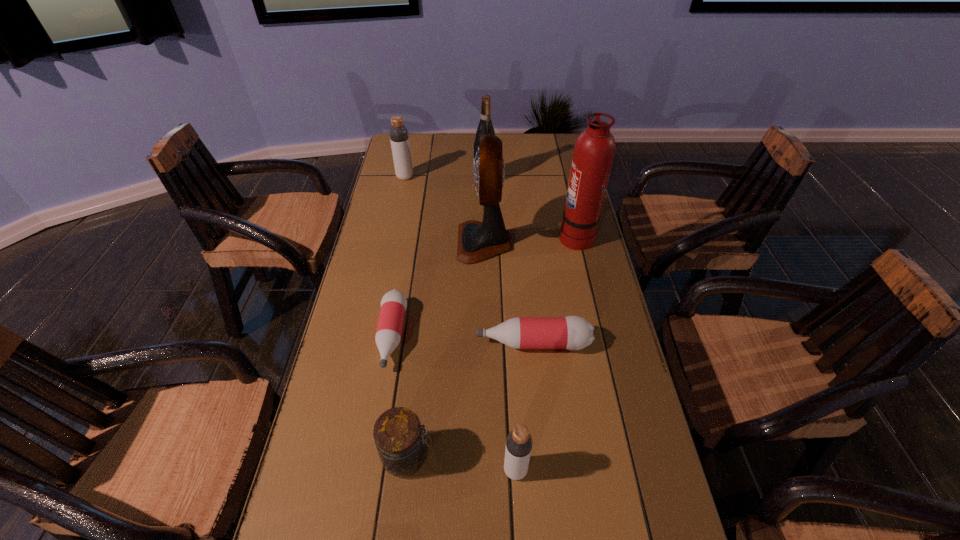
In the image, there is a desktop. At what (x,y) coordinates should I click in order to perform the action: click on free space at the left edge. Please return your answer as a coordinate pair (x, y). Looking at the image, I should click on (325, 420).

At what (x,y) coordinates should I click in order to perform the action: click on vacant space at the right edge. Please return your answer as a coordinate pair (x, y). Looking at the image, I should click on (570, 364).

The width and height of the screenshot is (960, 540). Find the location of `unoccupied position between the sixth tallest object and the wine bottle`. unoccupied position between the sixth tallest object and the wine bottle is located at coordinates (446, 318).

Locate an element on the screen. This screenshot has height=540, width=960. vacant area that lies between the fire extinguisher and the jar is located at coordinates (492, 346).

Find the location of a particular element. unoccupied area between the jar and the wine bottle is located at coordinates (446, 318).

What are the coordinates of `free point between the fire extinguisher and the wine bottle` in the screenshot? It's located at (531, 207).

Locate an element on the screen. vacant space that's between the second shortest object and the shortest bottle is located at coordinates (462, 339).

At what (x,y) coordinates should I click in order to perform the action: click on empty space that is in between the smaller pink bottle and the wine bottle. Please return your answer as a coordinate pair (x, y). This screenshot has height=540, width=960. Looking at the image, I should click on tap(439, 258).

Identify the location of unoccupied position between the fourth tallest object and the fan. (444, 210).

The height and width of the screenshot is (540, 960). I want to click on object that is the closest to the brown fan, so click(594, 150).